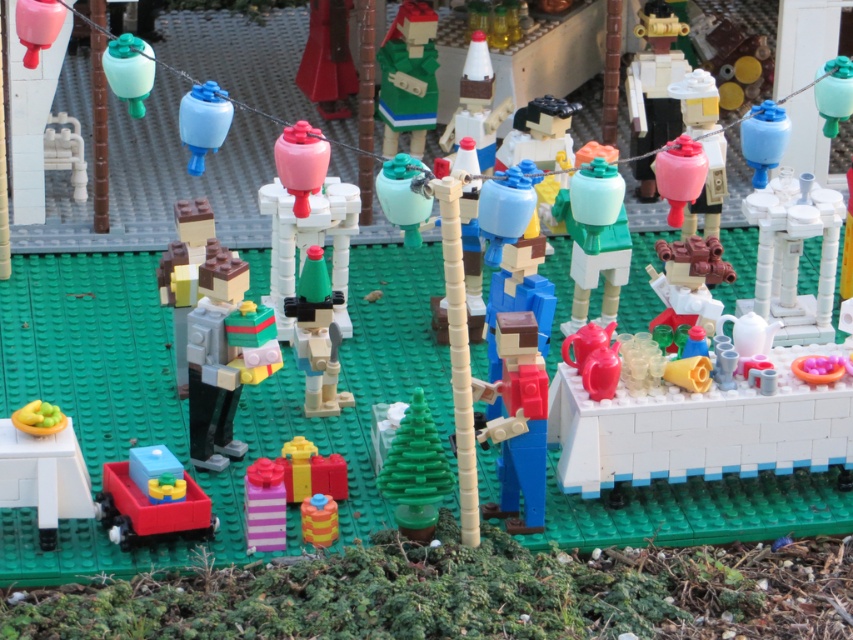
Question: Is matte gold robot at upper right wider than translucent blue plastic cube at lower left?

Choices:
 (A) yes
 (B) no

Answer: (B)

Question: Is matte gold robot at upper right wider than translucent blue plastic cube at lower left?

Choices:
 (A) no
 (B) yes

Answer: (A)

Question: Estimate the real-world distances between objects in this image. Which object is closer to the striped plastic bottle at lower center?

Choices:
 (A) matte pink vase at center
 (B) translucent blue plastic cube at lower left
 (C) matte white table at lower left
 (D) translucent green lantern at upper left

Answer: (B)

Question: Which object appears closest to the camera in this image?

Choices:
 (A) matte gold robot at upper right
 (B) blue glossy lantern at upper right

Answer: (B)

Question: Which point is closer to the camera?

Choices:
 (A) striped yellow and orange toy at center
 (B) matte white table at lower left
 (C) matte gold robot at upper right
 (D) white glossy vase at upper right

Answer: (B)

Question: Can you confirm if white glossy vase at upper right is wider than translucent blue plastic ornament at upper center?

Choices:
 (A) no
 (B) yes

Answer: (B)